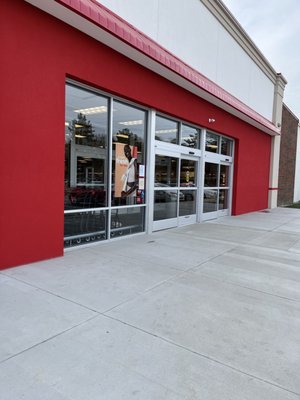
Where is `poster`? poster is located at coordinates (130, 159).